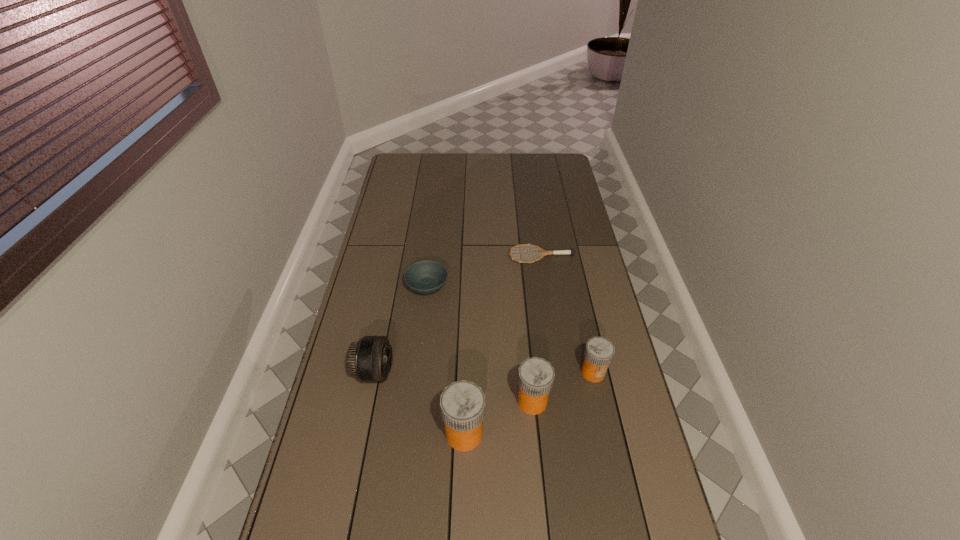
Point out which object is positioned as the fifth nearest to the third object from left to right. Please provide its 2D coordinates. Your answer should be formatted as a tuple, i.e. [(x, y)], where the tuple contains the x and y coordinates of a point satisfying the conditions above.

[(543, 252)]

Locate which object is the second closest to the soup bowl. Please provide its 2D coordinates. Your answer should be formatted as a tuple, i.e. [(x, y)], where the tuple contains the x and y coordinates of a point satisfying the conditions above.

[(543, 252)]

Locate which medicine ranks in proximity to the second medicine from right to left. Please provide its 2D coordinates. Your answer should be formatted as a tuple, i.e. [(x, y)], where the tuple contains the x and y coordinates of a point satisfying the conditions above.

[(462, 403)]

What are the coordinates of `medicine that stands as the closest to the shortest object` in the screenshot? It's located at (x=599, y=351).

This screenshot has width=960, height=540. I want to click on free location that satisfies the following two spatial constraints: 1. on the label side of the rightmost medicine; 2. on the label side of the leftmost medicine, so click(607, 434).

This screenshot has width=960, height=540. In order to click on free location that satisfies the following two spatial constraints: 1. on the front side of the tennis racket; 2. on the label side of the leftmost medicine in this screenshot , I will do 568,434.